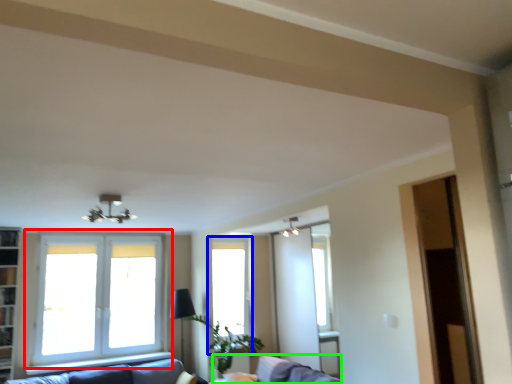
Question: Which object is positioned closest to window (highlighted by a red box)? Select from window (highlighted by a blue box) and swivel chair (highlighted by a green box).

Choices:
 (A) window
 (B) swivel chair

Answer: (A)